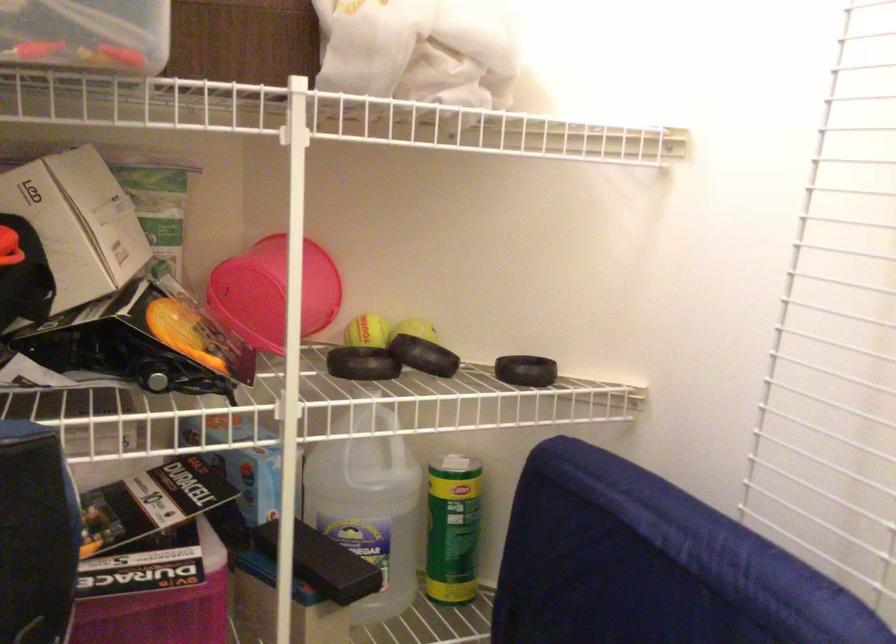
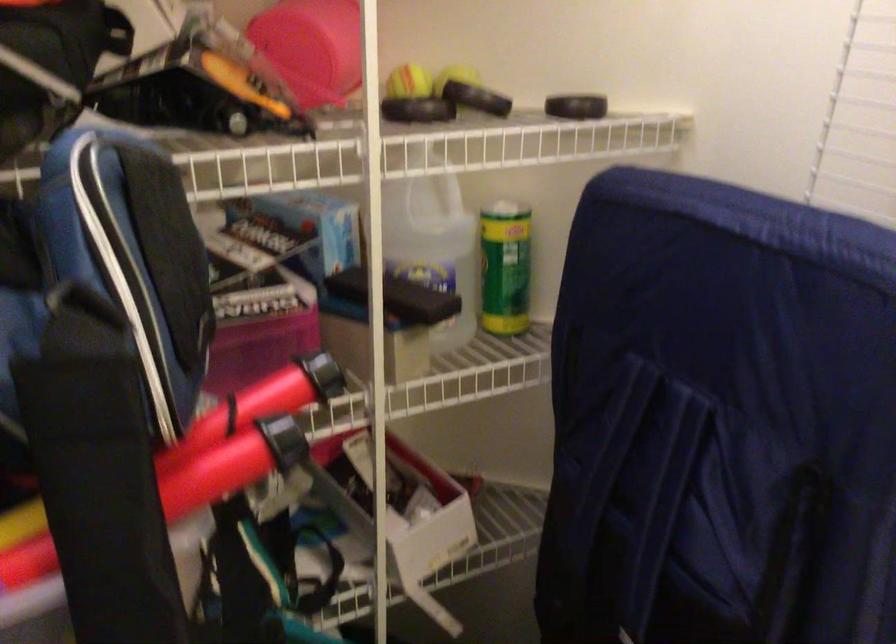
The point at (360, 335) is marked in the first image. Where is the corresponding point in the second image?

(409, 82)